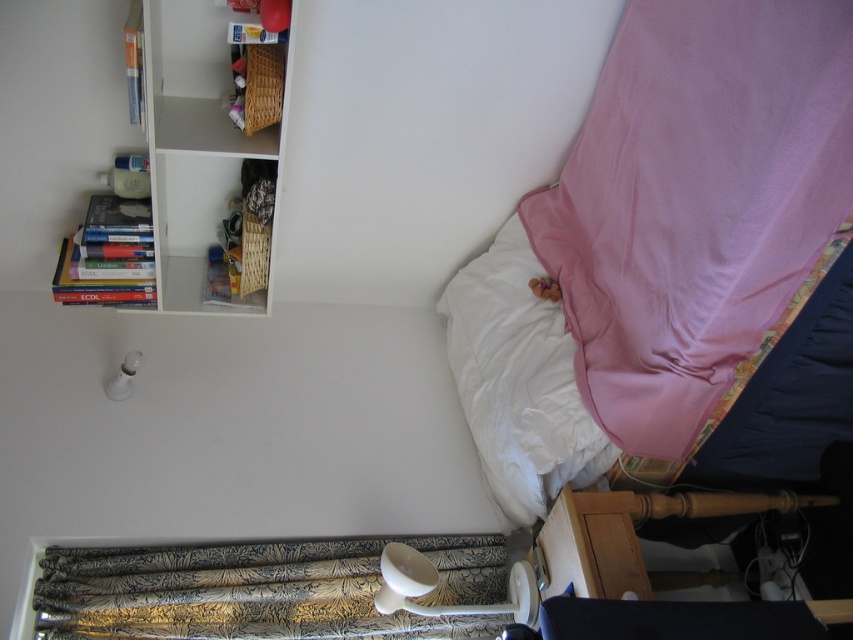
Can you confirm if white matte bookshelf at upper left is shorter than wooden basket at upper left?

Incorrect, white matte bookshelf at upper left's height does not fall short of wooden basket at upper left's.

Identify the location of white matte bookshelf at upper left. This screenshot has width=853, height=640. (202, 163).

Is pink fabric curtain at right wider than white soft pillow at upper right?

Indeed, pink fabric curtain at right has a greater width compared to white soft pillow at upper right.

Based on the photo, who is taller, pink fabric curtain at right or white soft pillow at upper right?

pink fabric curtain at right

Find the location of a particular element. This screenshot has width=853, height=640. pink fabric curtain at right is located at coordinates (695, 202).

You are a GUI agent. You are given a task and a screenshot of the screen. Output one action in this format:
    pyautogui.click(x=<x>, y=<y>)
    Task: Click on the pink fabric curtain at right
    This screenshot has width=853, height=640.
    Given the screenshot: What is the action you would take?
    pyautogui.click(x=695, y=202)

Who is positioned more to the left, white matte bookshelf at upper left or gold-patterned fabric curtain at lower left?

Positioned to the left is white matte bookshelf at upper left.

Does white matte bookshelf at upper left have a larger size compared to gold-patterned fabric curtain at lower left?

Yes, white matte bookshelf at upper left is bigger than gold-patterned fabric curtain at lower left.

Does point (173, 80) lie behind point (453, 540)?

No, (173, 80) is in front of (453, 540).

This screenshot has height=640, width=853. Find the location of `white matte bookshelf at upper left`. white matte bookshelf at upper left is located at coordinates (202, 163).